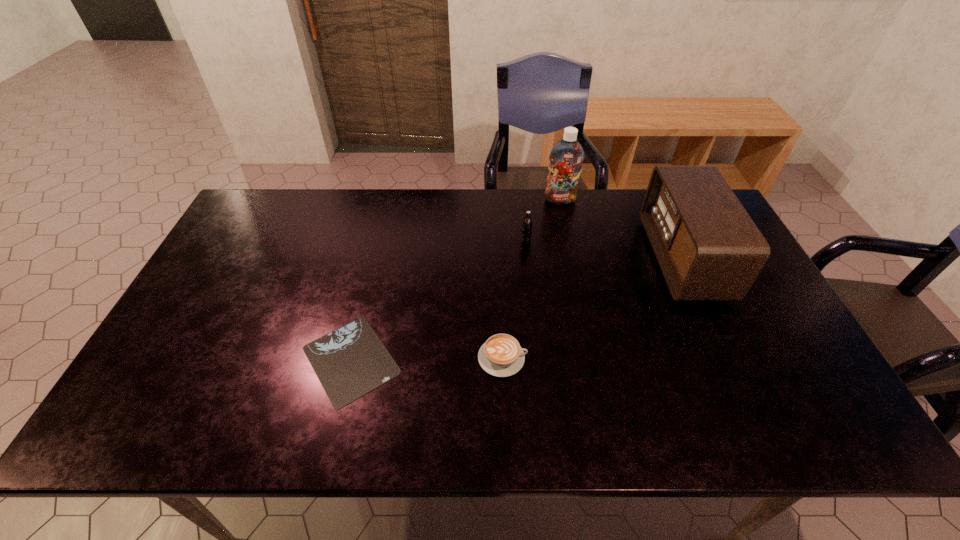
Where is `object at the right edge`? This screenshot has height=540, width=960. object at the right edge is located at coordinates (708, 247).

This screenshot has height=540, width=960. I want to click on object located at the far right corner, so click(708, 247).

The image size is (960, 540). I want to click on blank area at the far edge, so click(x=468, y=200).

At what (x,y) coordinates should I click in order to perform the action: click on free space at the near edge of the desktop. Please return your answer as a coordinate pair (x, y). Looking at the image, I should click on (353, 439).

Find the location of a particular element. This screenshot has width=960, height=540. free spot at the left edge of the desktop is located at coordinates (191, 326).

This screenshot has height=540, width=960. I want to click on vacant area at the right edge, so click(x=748, y=326).

Locate an element on the screen. The height and width of the screenshot is (540, 960). empty location between the pop and the tallest object is located at coordinates (543, 220).

This screenshot has width=960, height=540. I want to click on empty space that is in between the fourth object from left to right and the pop, so click(543, 220).

This screenshot has height=540, width=960. I want to click on unoccupied area between the farthest object and the shortest object, so click(456, 280).

What are the coordinates of `vacant area that lies between the shortest object and the third object from left to right` in the screenshot? It's located at (439, 300).